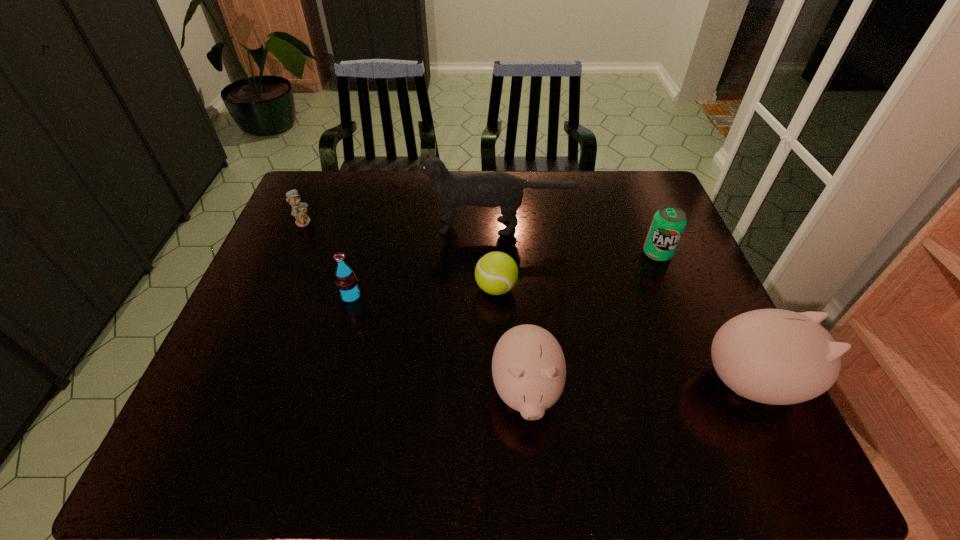
The height and width of the screenshot is (540, 960). In order to click on vacant area located 0.100m on the front-facing side of the leftmost object in this screenshot , I will do `click(344, 221)`.

Image resolution: width=960 pixels, height=540 pixels. What are the coordinates of `free space located on the front-facing side of the tallest object` in the screenshot? It's located at (347, 226).

In order to click on free space located on the front-facing side of the tallest object in this screenshot , I will do `click(409, 226)`.

Locate an element on the screen. This screenshot has height=540, width=960. vacant space located on the front-facing side of the tallest object is located at coordinates (321, 226).

Where is `free space located on the front-facing side of the right soda`? free space located on the front-facing side of the right soda is located at coordinates (681, 310).

The width and height of the screenshot is (960, 540). I want to click on vacant space located 0.200m on the back of the tennis ball, so click(x=493, y=227).

Locate an element on the screen. free space located on the left of the second object from left to right is located at coordinates (303, 296).

Locate an element on the screen. The height and width of the screenshot is (540, 960). object at the left edge is located at coordinates [x=299, y=210].

Where is `piggy bank positioned at the right edge`? piggy bank positioned at the right edge is located at coordinates (773, 356).

Locate an element on the screen. Image resolution: width=960 pixels, height=540 pixels. pop soda located in the right edge section of the desktop is located at coordinates (668, 224).